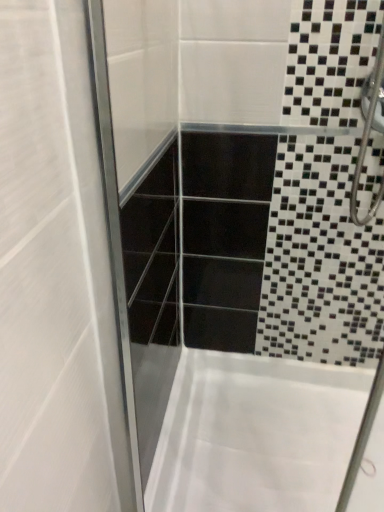
Question: Should I look upward or downward to see white fabric bathtub at lower center?

Choices:
 (A) up
 (B) down

Answer: (B)